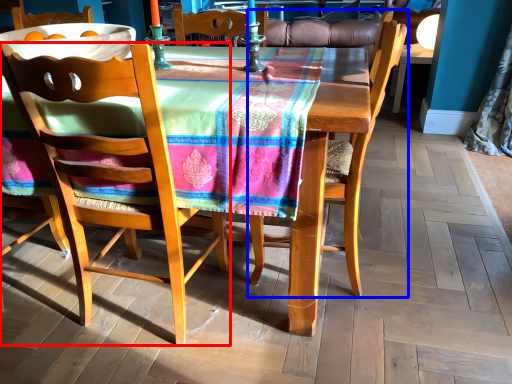
Question: Among these objects, which one is nearest to the camera, chair (highlighted by a red box) or chair (highlighted by a blue box)?

Choices:
 (A) chair
 (B) chair

Answer: (A)